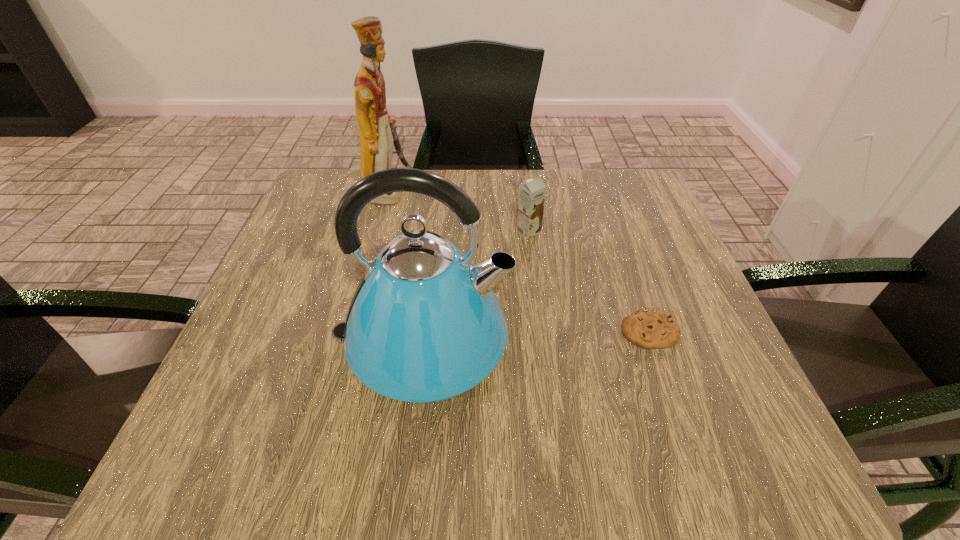
I want to click on nutcracker that is at the far edge, so click(x=377, y=130).

Image resolution: width=960 pixels, height=540 pixels. What are the coordinates of `chocolate milk located at the far edge` in the screenshot? It's located at (531, 198).

The image size is (960, 540). What are the coordinates of `object situated at the near edge` in the screenshot? It's located at (424, 326).

I want to click on object that is positioned at the left edge, so click(377, 130).

Where is `object at the right edge`? The height and width of the screenshot is (540, 960). object at the right edge is located at coordinates (650, 328).

At what (x,y) coordinates should I click in order to perform the action: click on object present at the far left corner. Please return your answer as a coordinate pair (x, y). This screenshot has width=960, height=540. Looking at the image, I should click on (377, 130).

In the image, there is a desktop. Where is `free space at the near edge`? The width and height of the screenshot is (960, 540). free space at the near edge is located at coordinates (372, 467).

In the image, there is a desktop. Where is `vacant space at the left edge`? vacant space at the left edge is located at coordinates (263, 285).

This screenshot has width=960, height=540. What are the coordinates of `free space at the right edge of the desktop` in the screenshot? It's located at (675, 274).

Where is `free space at the far left corner of the desktop`? This screenshot has height=540, width=960. free space at the far left corner of the desktop is located at coordinates (305, 201).